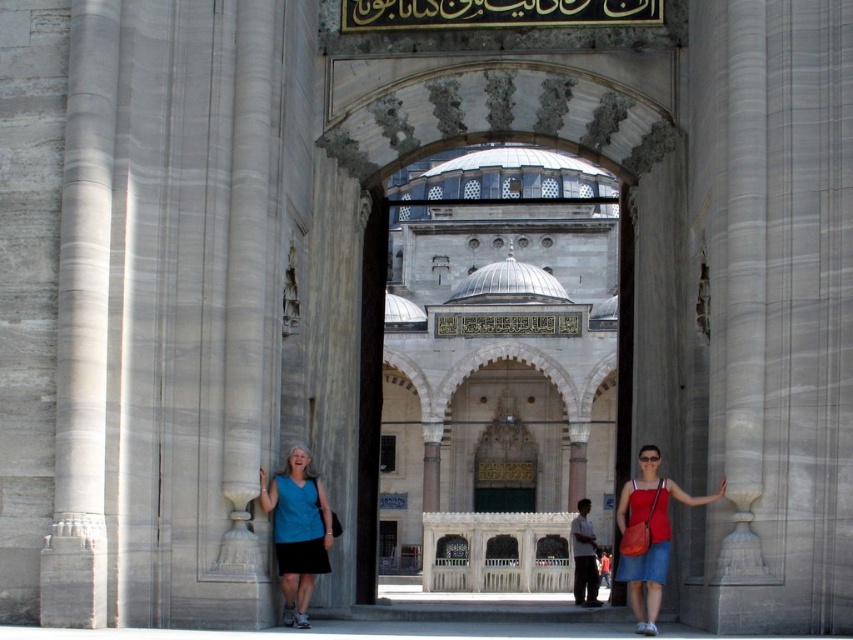
Who is lower down, white marble arch at center or red fabric bag at right?

red fabric bag at right is lower down.

Can you confirm if white marble arch at center is shorter than red fabric bag at right?

Incorrect, white marble arch at center's height does not fall short of red fabric bag at right's.

The height and width of the screenshot is (640, 853). In order to click on white marble arch at center in this screenshot , I will do `click(496, 339)`.

Locate an element on the screen. This screenshot has height=640, width=853. white marble arch at center is located at coordinates (496, 339).

Can you confirm if blue fabric dress at lower left is thinner than red fabric bag at right?

Yes, blue fabric dress at lower left is thinner than red fabric bag at right.

Who is more forward, (265, 486) or (646, 477)?

Positioned in front is point (265, 486).

Which is in front, point (283, 548) or point (627, 484)?

Positioned in front is point (283, 548).

Where is `blue fabric dress at lower left`? The width and height of the screenshot is (853, 640). blue fabric dress at lower left is located at coordinates (297, 531).

Does red fabric bag at right appear on the right side of matte blue shirt at center?

Incorrect, red fabric bag at right is not on the right side of matte blue shirt at center.

Which is above, red fabric bag at right or matte blue shirt at center?

red fabric bag at right is higher up.

The image size is (853, 640). Find the location of `red fabric bag at right`. red fabric bag at right is located at coordinates (648, 536).

You are a GUI agent. You are given a task and a screenshot of the screen. Output one action in this format:
    pyautogui.click(x=<x>, y=<y>)
    Task: Click on the red fabric bag at right
    Image resolution: width=853 pixels, height=640 pixels.
    Given the screenshot: What is the action you would take?
    pyautogui.click(x=648, y=536)